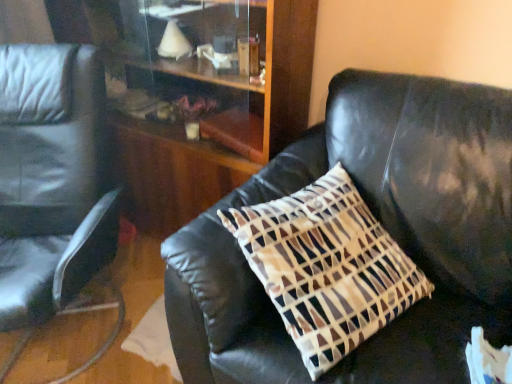
Question: Is velvet brown pillow at center positioned behind matte black chair at left?

Choices:
 (A) no
 (B) yes

Answer: (A)

Question: Is velvet brown pillow at center wider than matte black chair at left?

Choices:
 (A) yes
 (B) no

Answer: (B)

Question: Is velvet brown pillow at center oriented away from matte black chair at left?

Choices:
 (A) no
 (B) yes

Answer: (A)

Question: Does velvet brown pillow at center have a smaller size compared to matte black chair at left?

Choices:
 (A) yes
 (B) no

Answer: (A)

Question: Does velvet brown pillow at center have a lesser height compared to matte black chair at left?

Choices:
 (A) no
 (B) yes

Answer: (B)

Question: From the image's perspective, would you say velvet brown pillow at center is positioned over matte black chair at left?

Choices:
 (A) no
 (B) yes

Answer: (A)

Question: Is matte black chair at left aimed at wooden dresser at center?

Choices:
 (A) no
 (B) yes

Answer: (A)

Question: From the image's perspective, is matte black chair at left on wooden dresser at center?

Choices:
 (A) no
 (B) yes

Answer: (A)

Question: Is matte black chair at left positioned with its back to wooden dresser at center?

Choices:
 (A) no
 (B) yes

Answer: (B)

Question: Does matte black chair at left come behind wooden dresser at center?

Choices:
 (A) yes
 (B) no

Answer: (B)

Question: Can wooden dresser at center be found inside matte black chair at left?

Choices:
 (A) no
 (B) yes

Answer: (A)

Question: Does matte black chair at left have a larger size compared to wooden dresser at center?

Choices:
 (A) no
 (B) yes

Answer: (B)

Question: From a real-world perspective, is matte black chair at left on velvet brown pillow at center?

Choices:
 (A) yes
 (B) no

Answer: (B)